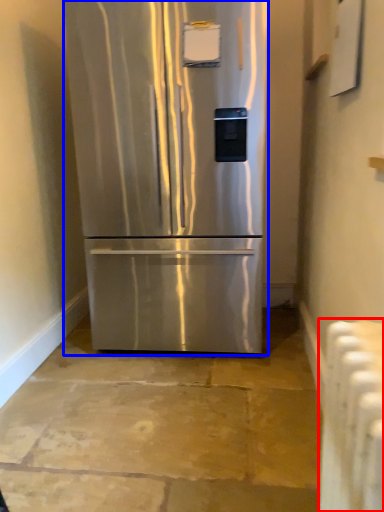
Question: Among these objects, which one is farthest to the camera, radiator (highlighted by a red box) or refrigerator (highlighted by a blue box)?

Choices:
 (A) radiator
 (B) refrigerator

Answer: (B)